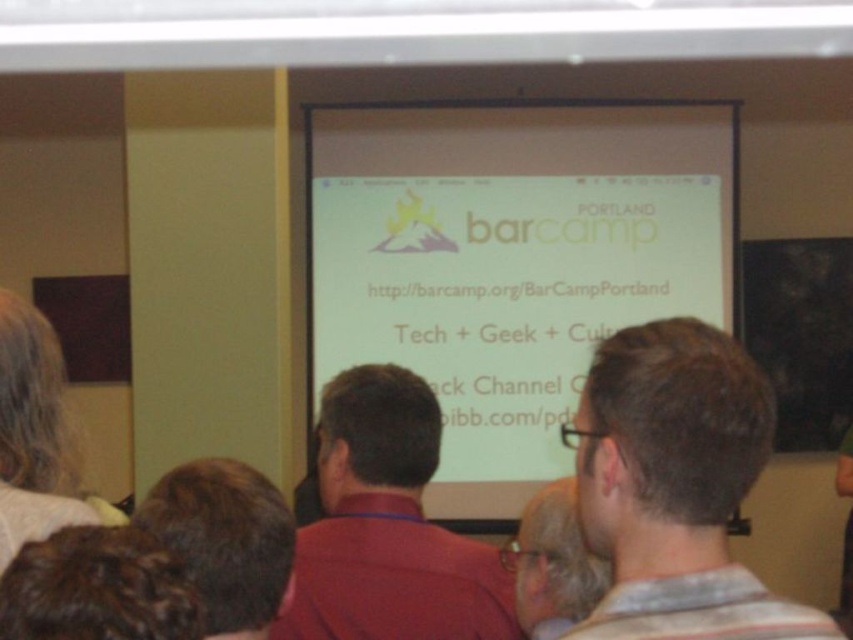
Is white matte projection screen at center above brown hair at lower left?

Correct, white matte projection screen at center is located above brown hair at lower left.

Who is positioned more to the left, white matte projection screen at center or brown hair at lower left?

brown hair at lower left

Between point (497, 268) and point (260, 600), which one is positioned in front?

Point (260, 600) is more forward.

Where is `white matte projection screen at center`? The height and width of the screenshot is (640, 853). white matte projection screen at center is located at coordinates (511, 259).

Can you confirm if brown hair at upper right is smaller than brown hair at lower left?

Actually, brown hair at upper right might be larger than brown hair at lower left.

Who is more distant from viewer, (793, 614) or (252, 481)?

The point (252, 481) is more distant.

Who is more forward, (x=694, y=355) or (x=218, y=525)?

Positioned in front is point (x=694, y=355).

Identify the location of brown hair at upper right. (675, 486).

Does white matte projection screen at center have a larger size compared to brown hair at upper right?

Yes, white matte projection screen at center is bigger than brown hair at upper right.

Is white matte projection screen at center above brown hair at upper right?

Correct, white matte projection screen at center is located above brown hair at upper right.

Is point (340, 342) less distant than point (621, 480)?

No, (340, 342) is behind (621, 480).

Where is `white matte projection screen at center`? The width and height of the screenshot is (853, 640). white matte projection screen at center is located at coordinates (511, 259).